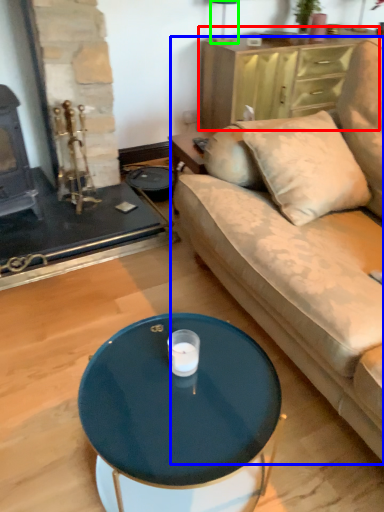
Question: Which object is the closest to the dresser (highlighted by a red box)? Choose among these: studio couch (highlighted by a blue box) or lamp (highlighted by a green box).

Choices:
 (A) studio couch
 (B) lamp

Answer: (B)